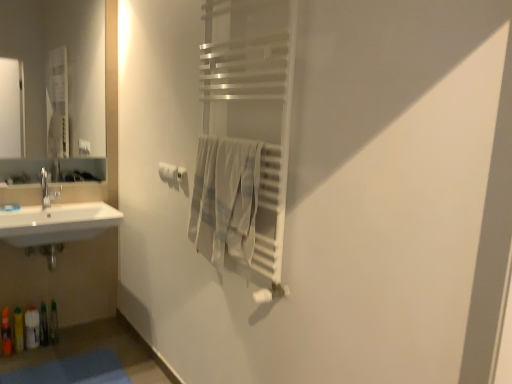
You are a GUI agent. You are given a task and a screenshot of the screen. Output one action in this format:
    pyautogui.click(x=<x>, y=<y>)
    Task: Click on the free point to the right of translucent plastic bottles at lower left, the 3th toiletry in the right-to-left sequence
    The image size is (512, 384).
    Given the screenshot: What is the action you would take?
    pyautogui.click(x=48, y=350)